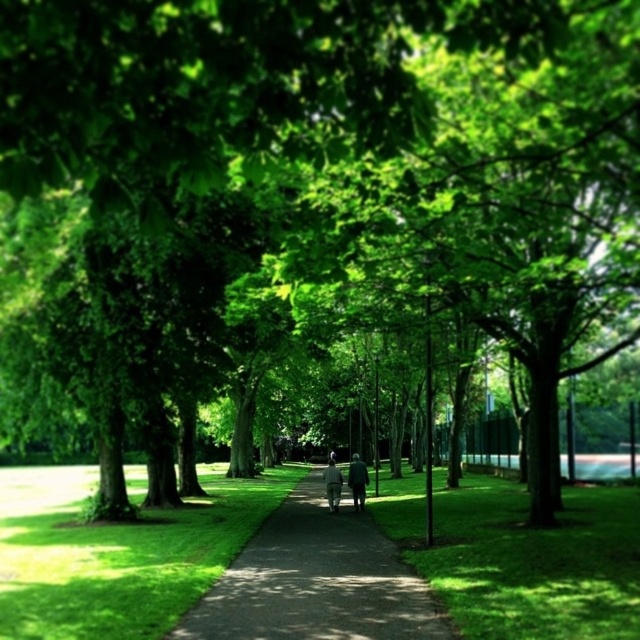
Question: Does dark gray suit at center appear under white cotton jacket at center?

Choices:
 (A) yes
 (B) no

Answer: (B)

Question: Observing the image, what is the correct spatial positioning of green grass at center in reference to dark gray asphalt path at center?

Choices:
 (A) above
 (B) below

Answer: (A)

Question: Which point is closer to the camera?

Choices:
 (A) (353, 499)
 (B) (620, 624)
 (C) (342, 513)

Answer: (B)

Question: Among these objects, which one is nearest to the camera?

Choices:
 (A) green soft grass at center
 (B) dark gray suit at center

Answer: (A)

Question: Is green soft grass at center wider than white cotton jacket at center?

Choices:
 (A) no
 (B) yes

Answer: (B)

Question: Which point is farther from the camera taking this photo?

Choices:
 (A) (122, 588)
 (B) (483, 608)
 (C) (236, 605)

Answer: (A)